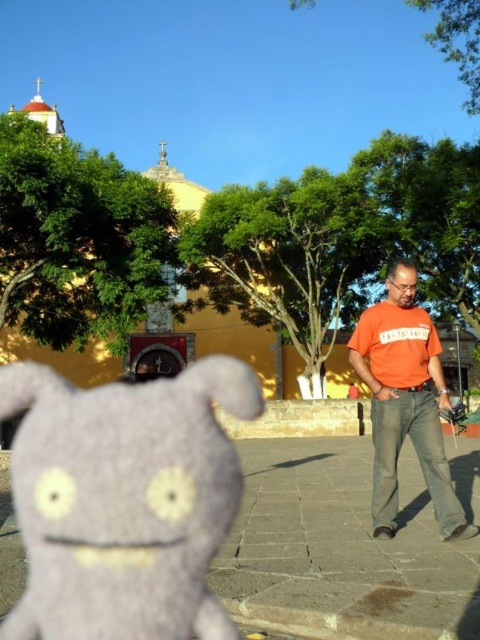
Question: Which of the following is the closest to the observer?

Choices:
 (A) (359, 317)
 (B) (66, 493)

Answer: (B)

Question: In this image, where is gray stone pavement at center located relative to orange cotton t-shirt at right?

Choices:
 (A) left
 (B) right

Answer: (A)

Question: From the image, what is the correct spatial relationship of gray stone pavement at center in relation to orange cotton t-shirt at right?

Choices:
 (A) right
 (B) left

Answer: (B)

Question: From the image, what is the correct spatial relationship of gray felt plush at center in relation to orange cotton t-shirt at right?

Choices:
 (A) right
 (B) left

Answer: (B)

Question: Estimate the real-world distances between objects in this image. Which object is closer to the gray stone pavement at center?

Choices:
 (A) gray felt plush at center
 (B) orange cotton t-shirt at right

Answer: (B)

Question: Estimate the real-world distances between objects in this image. Which object is closer to the gray felt plush at center?

Choices:
 (A) orange cotton t-shirt at right
 (B) gray stone pavement at center

Answer: (B)